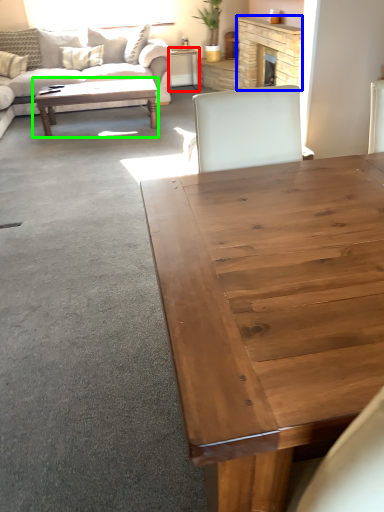
Question: Which object is the farthest from desk (highlighted by a red box)? Choose among these: fireplace (highlighted by a blue box) or coffee table (highlighted by a green box).

Choices:
 (A) fireplace
 (B) coffee table

Answer: (B)